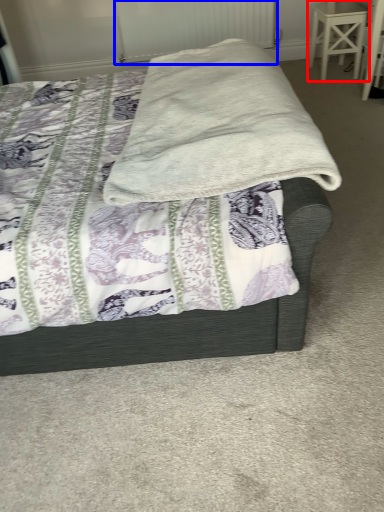
Question: Which point is further to the camera, stool (highlighted by a red box) or radiator (highlighted by a blue box)?

Choices:
 (A) stool
 (B) radiator

Answer: (B)